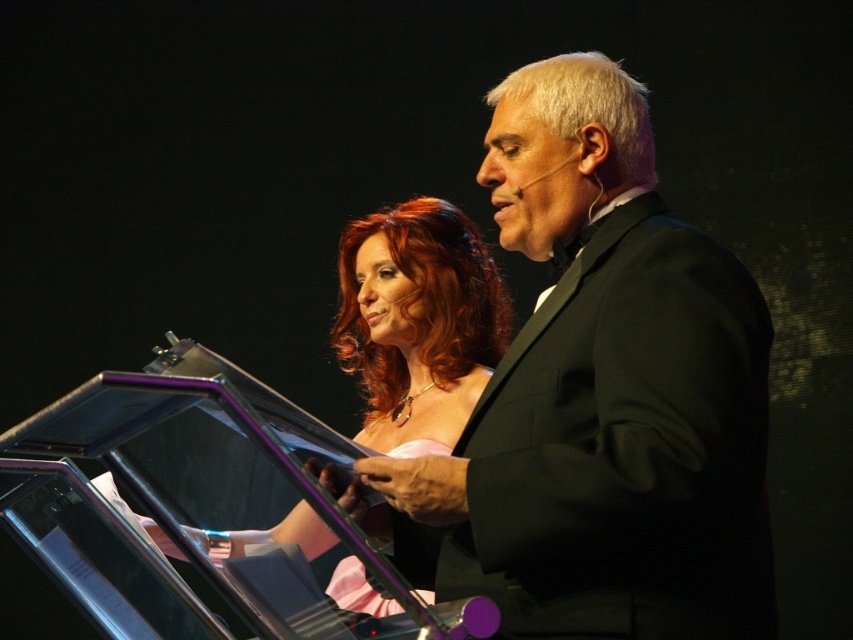
You are organizing a photo shoot and need to ensure that the two outfits displayed at the center of the image are spaced appropriately. Given the description of their sizes, can you determine if the black satin suit at center will require more space than the matte pink dress at center?

The black satin suit at center has a larger width than the matte pink dress at center, so it will require more space.

You are standing in front of the podium where the two individuals are speaking. You want to place a small flower bouquet between the two points marked as point (585, 84) and point (454, 364). Which point should the bouquet be closer to in order to be nearer to the speaker on the left?

The bouquet should be closer to point (585, 84) because it is closer to the viewer than point (454, 364), meaning it is positioned nearer to the speaker on the left.

You are a photographer at the event and want to capture a photo where the black satin suit at center and the matte pink dress at center are both visible. Based on their positions, which one should you focus on first to ensure both are in frame?

Since the black satin suit at center is to the right of the matte pink dress at center, you should focus on the matte pink dress at center first to ensure both are in frame by adjusting the camera angle from left to right.